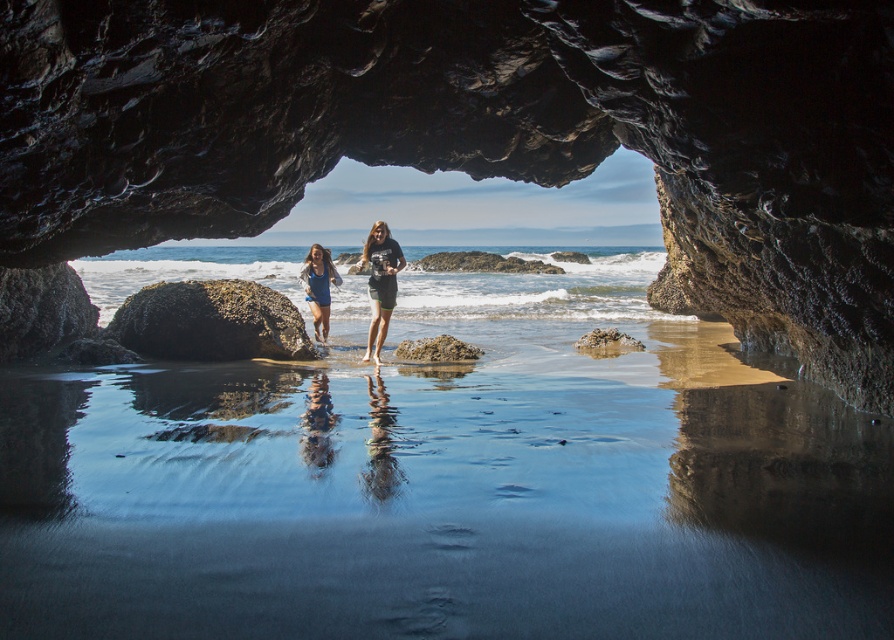
What do you see at coordinates (211, 323) in the screenshot? I see `rusty metallic rock at center` at bounding box center [211, 323].

Who is positioned more to the right, rusty metallic rock at center or matte blue dress at center?

Positioned to the right is matte blue dress at center.

Identify the location of rusty metallic rock at center. The height and width of the screenshot is (640, 894). point(211,323).

I want to click on rusty metallic rock at center, so click(211, 323).

How far apart are smooth dark rock at center and sandy brown rock at center?

smooth dark rock at center and sandy brown rock at center are 4.11 meters apart from each other.

Who is more forward, (823,168) or (462,346)?

Positioned in front is point (823,168).

Locate an element on the screen. smooth dark rock at center is located at coordinates (482, 132).

In the scene shown: Who is higher up, matte blue dress at center or smooth sandstone rock at center?

matte blue dress at center is above.

Can you confirm if matte blue dress at center is positioned above smooth sandstone rock at center?

Yes, matte blue dress at center is above smooth sandstone rock at center.

At what (x,y) coordinates should I click in order to perform the action: click on matte blue dress at center. Please return your answer as a coordinate pair (x, y). The height and width of the screenshot is (640, 894). Looking at the image, I should click on coord(318,288).